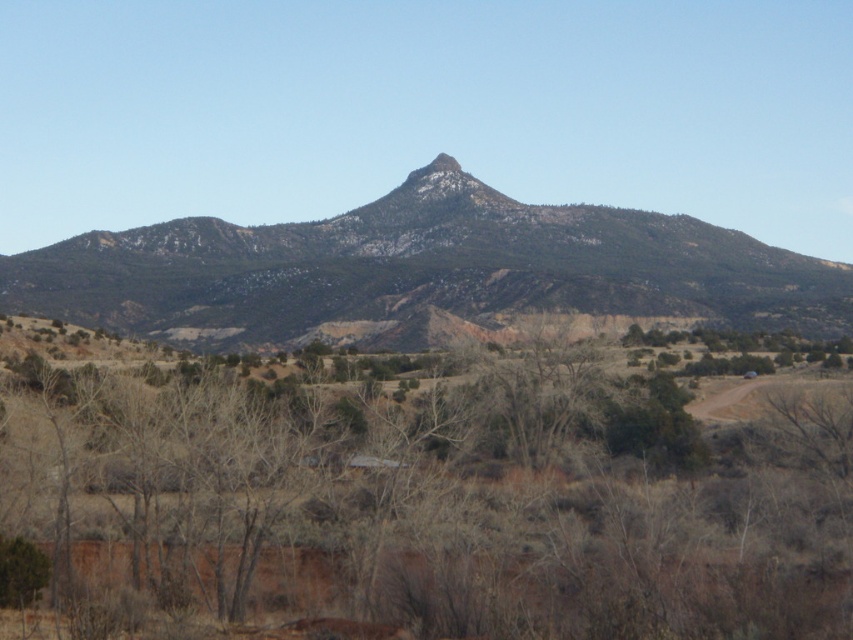
Question: From the image, what is the correct spatial relationship of brown/dry wood at center in relation to rocky brown mountain at center?

Choices:
 (A) left
 (B) right

Answer: (A)

Question: Can you confirm if brown/dry wood at center is positioned to the left of rocky brown mountain at center?

Choices:
 (A) yes
 (B) no

Answer: (A)

Question: Can you confirm if brown/dry wood at center is positioned above rocky brown mountain at center?

Choices:
 (A) no
 (B) yes

Answer: (A)

Question: Among these objects, which one is farthest from the camera?

Choices:
 (A) brown/dry wood at center
 (B) rocky brown mountain at center

Answer: (B)

Question: Which point is farther from the camera taking this photo?

Choices:
 (A) (775, 556)
 (B) (358, 246)

Answer: (B)